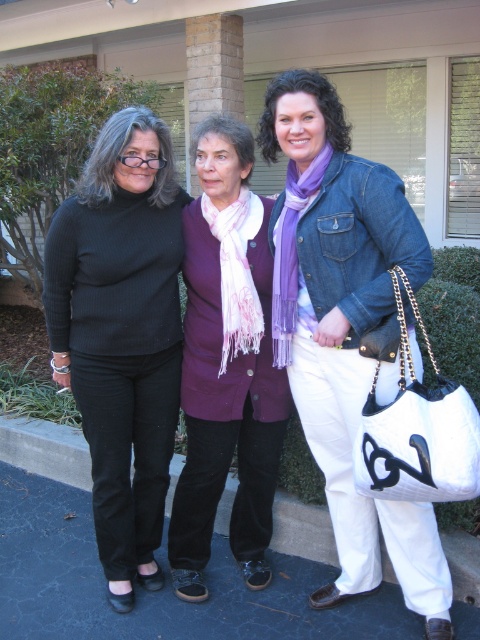
Question: Which point is closer to the camera?

Choices:
 (A) denim jacket at center
 (B) purple cotton scarf at center
 (C) ribbed black sweater at left

Answer: (A)

Question: Which object is positioned farthest from the ribbed black sweater at left?

Choices:
 (A) denim jacket at center
 (B) purple cotton scarf at center

Answer: (A)

Question: Is the position of denim jacket at center less distant than that of ribbed black sweater at left?

Choices:
 (A) no
 (B) yes

Answer: (B)

Question: Is denim jacket at center behind ribbed black sweater at left?

Choices:
 (A) no
 (B) yes

Answer: (A)

Question: Which object is the farthest from the denim jacket at center?

Choices:
 (A) ribbed black sweater at left
 (B) purple cotton scarf at center

Answer: (A)

Question: Can you confirm if denim jacket at center is thinner than purple cotton scarf at center?

Choices:
 (A) no
 (B) yes

Answer: (A)